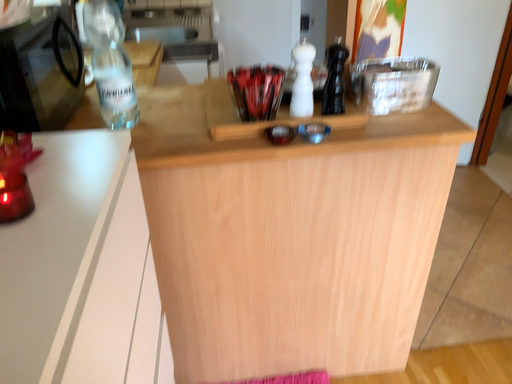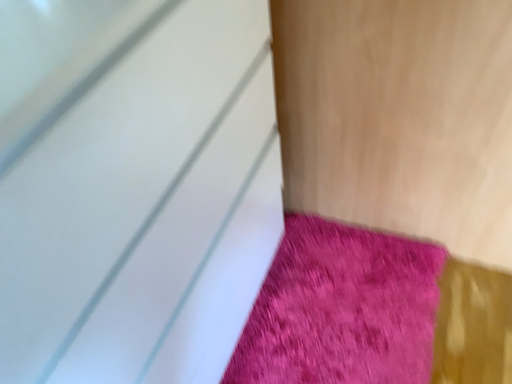
Question: Which way did the camera rotate in the video?

Choices:
 (A) rotated downward
 (B) rotated upward

Answer: (A)